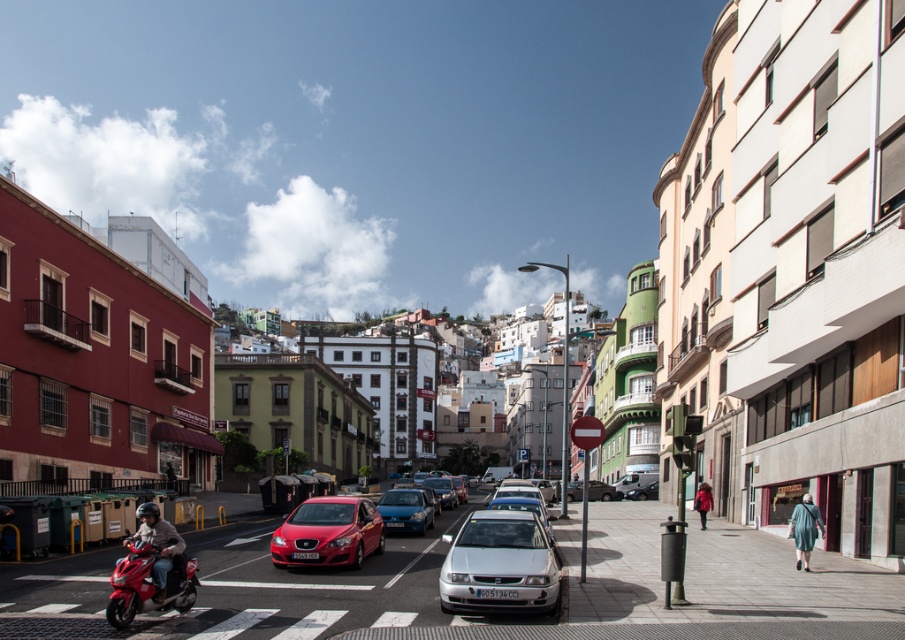
Question: Which object is farther from the camera taking this photo?

Choices:
 (A) shiny red sedan at center
 (B) shiny red scooter at lower left
 (C) blue fabric coat at lower right

Answer: (C)

Question: Can you confirm if silver metallic van at center is positioned below matte red coat at center?

Choices:
 (A) no
 (B) yes

Answer: (B)

Question: Does blue metallic hatchback at center appear under matte red coat at center?

Choices:
 (A) no
 (B) yes

Answer: (B)

Question: Which object is closer to the camera taking this photo?

Choices:
 (A) shiny red sedan at center
 (B) silver metallic van at center
 (C) white metallic car at center
 (D) blue fabric coat at lower right

Answer: (C)

Question: Does matte black motorcycle at lower left have a larger size compared to blue fabric coat at lower right?

Choices:
 (A) yes
 (B) no

Answer: (A)

Question: Which point appears closest to the camera in this image?

Choices:
 (A) (x=540, y=573)
 (B) (x=387, y=525)
 (C) (x=799, y=554)

Answer: (A)